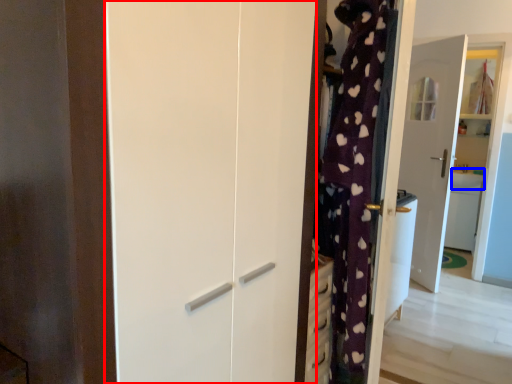
Question: Which object is closer to the camera taking this photo, screen door (highlighted by a red box) or counter top (highlighted by a blue box)?

Choices:
 (A) screen door
 (B) counter top

Answer: (A)